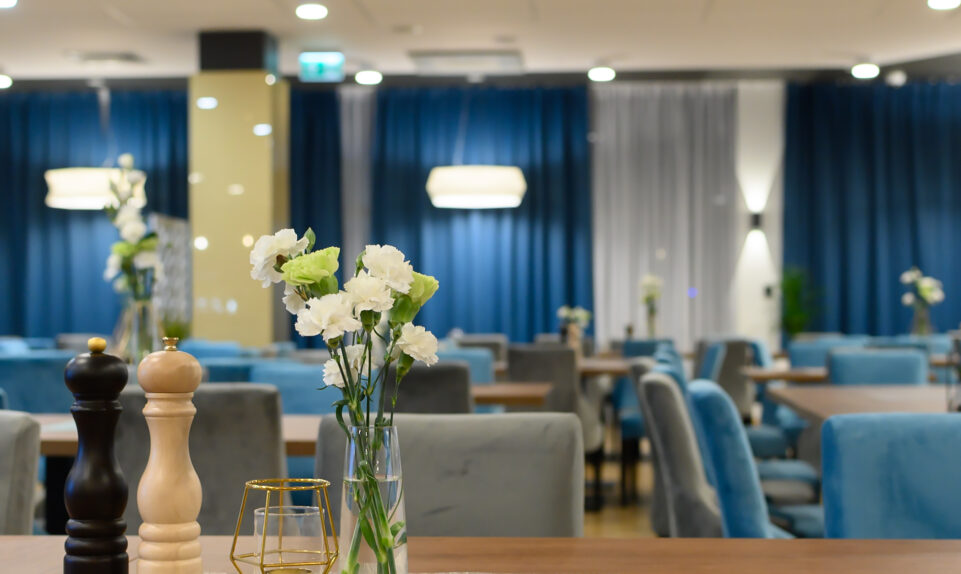
Where is `lights`? Image resolution: width=961 pixels, height=574 pixels. lights is located at coordinates (370, 84), (315, 18), (75, 196), (482, 188), (600, 69), (863, 77), (764, 214).